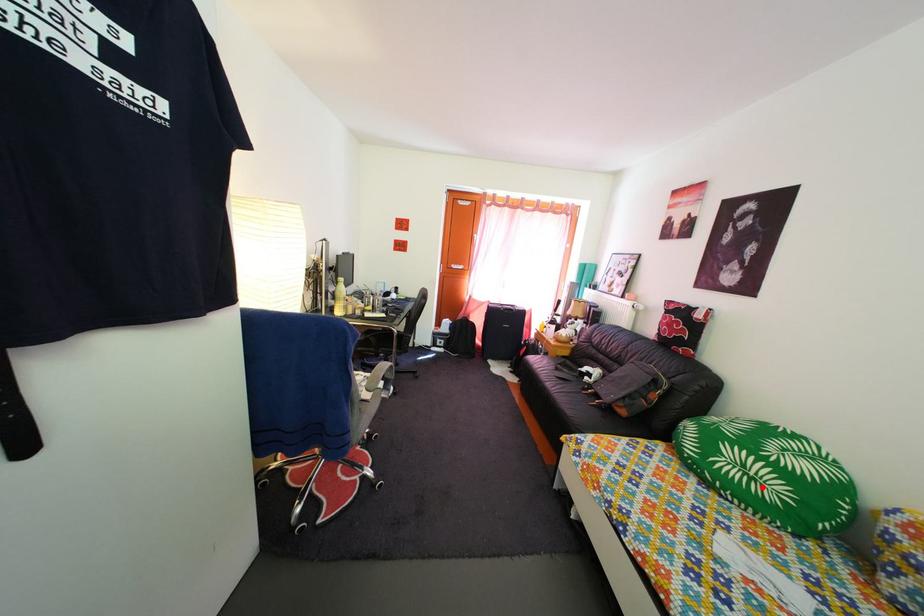
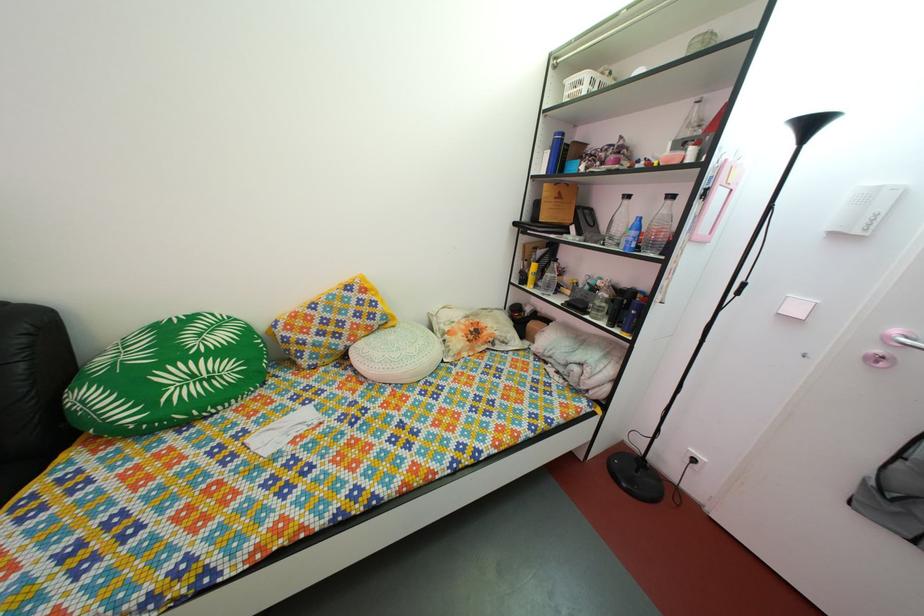
Where in the second image is the point corresponding to the highlighted location from the first image?

(220, 387)